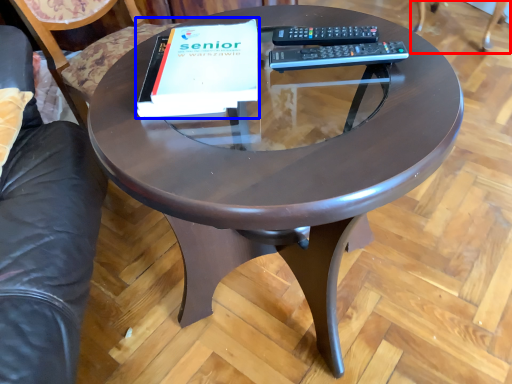
Question: Which object is further to the camera taking this photo, swivel chair (highlighted by a red box) or paperback book (highlighted by a blue box)?

Choices:
 (A) swivel chair
 (B) paperback book

Answer: (A)